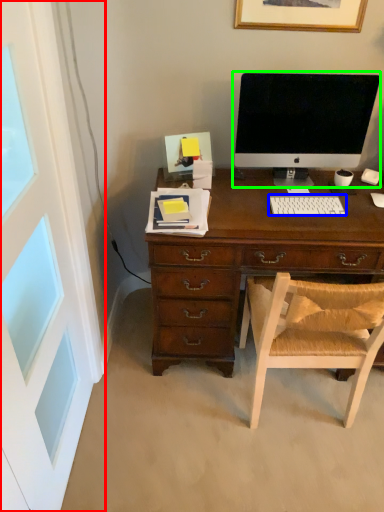
Question: Based on their relative distances, which object is farther from screen door (highlighted by a red box)? Choose from computer keyboard (highlighted by a blue box) and computer monitor (highlighted by a green box).

Choices:
 (A) computer keyboard
 (B) computer monitor

Answer: (B)